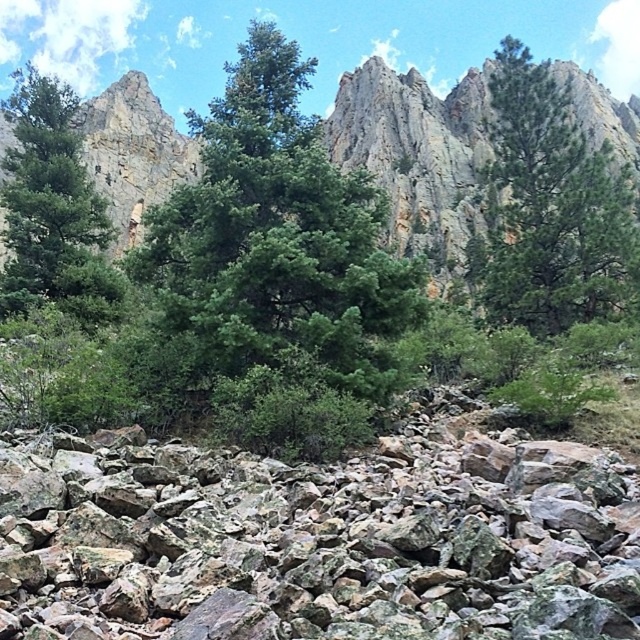
Question: Estimate the real-world distances between objects in this image. Which object is farther from the green textured tree at upper right?

Choices:
 (A) green leafy tree at center
 (B) green matte tree at left
 (C) green leafy trees at center

Answer: (B)

Question: Can you confirm if gray rough rocks at center is positioned above green textured tree at upper right?

Choices:
 (A) yes
 (B) no

Answer: (B)

Question: Can you confirm if gray rough rocks at center is thinner than green textured tree at upper right?

Choices:
 (A) no
 (B) yes

Answer: (B)

Question: Which object appears closest to the camera in this image?

Choices:
 (A) green leafy trees at center
 (B) gray rough rocks at center
 (C) green leafy tree at center
 (D) green textured tree at upper right

Answer: (B)

Question: Does gray rough rocks at center have a smaller size compared to green textured tree at upper right?

Choices:
 (A) no
 (B) yes

Answer: (B)

Question: Which object is farther from the camera taking this photo?

Choices:
 (A) green matte tree at left
 (B) gray rough rocks at center

Answer: (A)